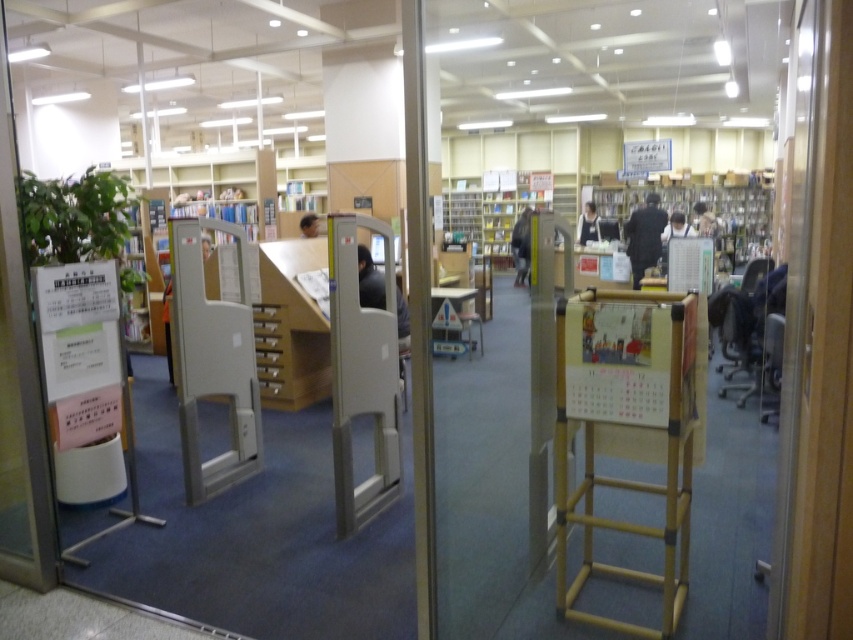
Between point (656, 212) and point (698, 205), which one is positioned in front?

Positioned in front is point (656, 212).

Does dark gray coat at center have a greater width compared to light brown hair at upper center?

In fact, dark gray coat at center might be narrower than light brown hair at upper center.

Between point (653, 205) and point (709, 212), which one is positioned in front?

Positioned in front is point (653, 205).

Find the location of a particular element. This screenshot has width=853, height=640. dark gray coat at center is located at coordinates (643, 236).

Who is positioned more to the left, light brown hair at upper center or smooth gray computer at center?

smooth gray computer at center

The height and width of the screenshot is (640, 853). What do you see at coordinates (705, 220) in the screenshot?
I see `light brown hair at upper center` at bounding box center [705, 220].

Is point (701, 214) in front of point (207, 244)?

No, (701, 214) is behind (207, 244).

Find the location of a particular element. This screenshot has height=640, width=853. light brown hair at upper center is located at coordinates (705, 220).

Is dark gray sweater at center wider than matte black laptop at center?

Yes, dark gray sweater at center is wider than matte black laptop at center.

Can you confirm if dark gray sweater at center is bigger than matte black laptop at center?

Yes, dark gray sweater at center is bigger than matte black laptop at center.

Is point (529, 244) positioned after point (314, 234)?

Yes, point (529, 244) is behind point (314, 234).

Locate an element on the screen. dark gray sweater at center is located at coordinates (521, 244).